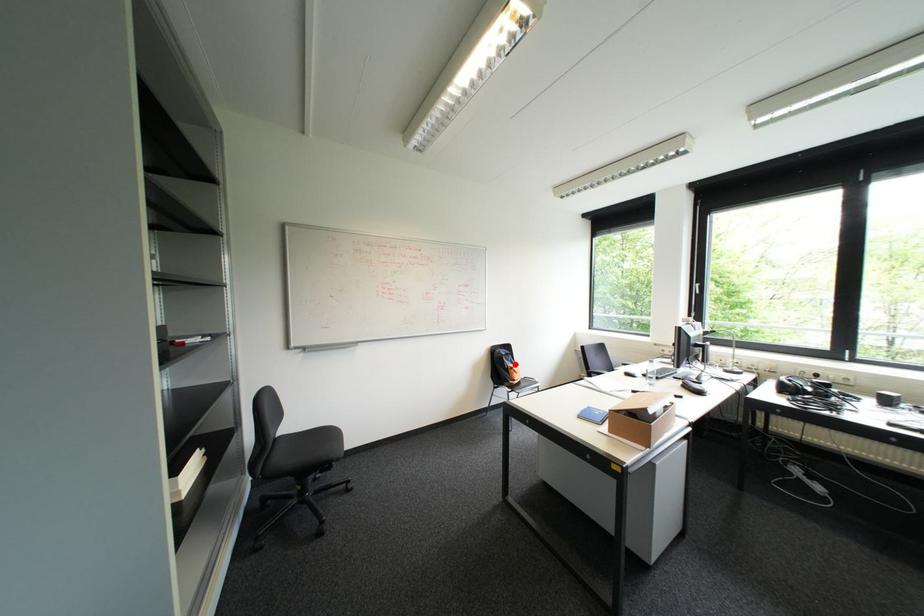
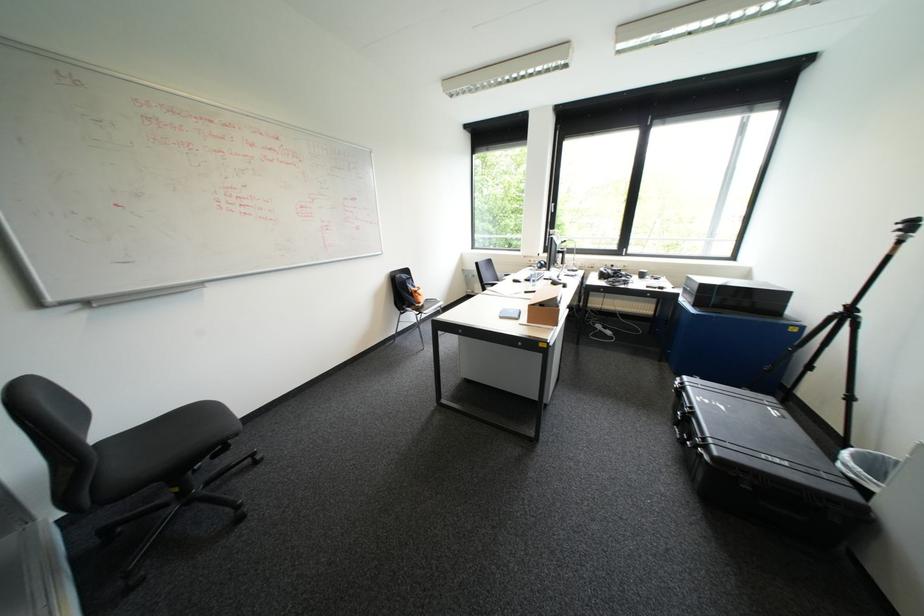
Question: I am providing you with two images of the same scene from different viewpoints. Image1 has a red point marked. In image2, the corresponding 3D location appears at what relative position? Reply with the corresponding letter.

Choices:
 (A) Closer
 (B) Farther

Answer: (A)